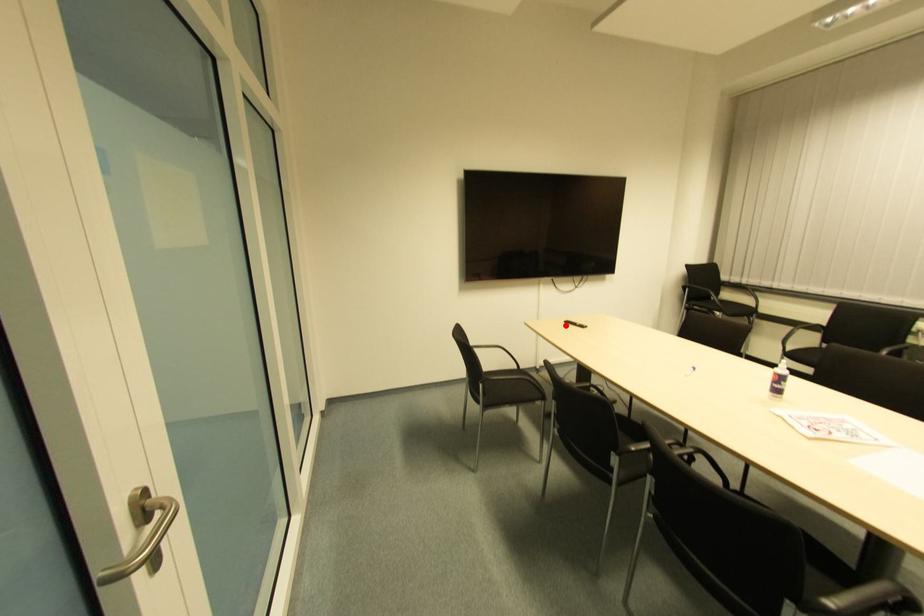
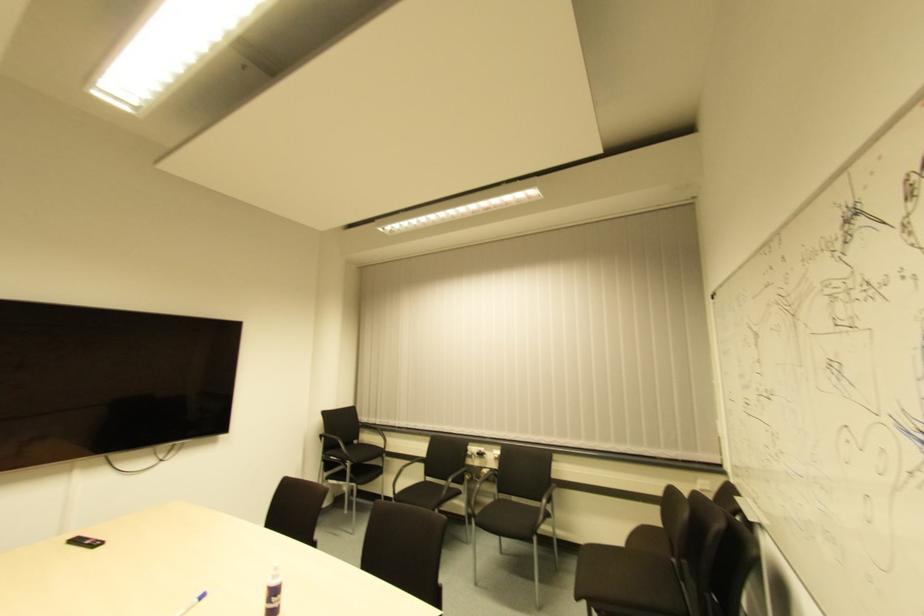
Where in the second image is the point corresponding to the highlighted location from the first image?

(73, 543)